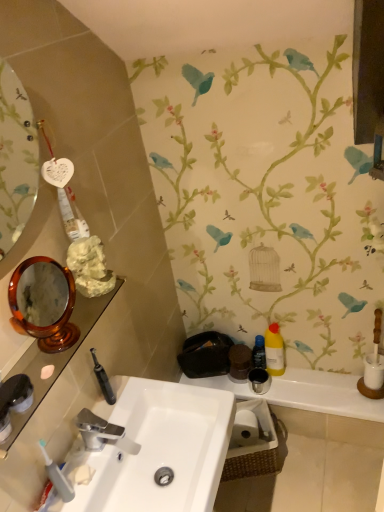
Question: Is point (208, 385) positioned closer to the camera than point (84, 418)?

Choices:
 (A) closer
 (B) farther

Answer: (B)

Question: In the image, is matte black tray at lower center positioned in front of or behind silver metallic faucet at center?

Choices:
 (A) behind
 (B) front

Answer: (A)

Question: Considering the real-world distances, which object is closest to the translucent plastic toothbrush at lower left?

Choices:
 (A) silver metallic faucet at center
 (B) black plastic bottle at right, the 1th mouthwash in the left-to-right sequence
 (C) amber glass mirror at left
 (D) white matte toilet paper at lower center
 (E) white glossy sink at center

Answer: (A)

Question: Which object is the closest to the amber glass mirror at left?

Choices:
 (A) silver metallic faucet at center
 (B) translucent plastic toothbrush at lower left
 (C) black plastic bottle at right, the 1th mouthwash in the left-to-right sequence
 (D) white glossy sink at center
 (E) matte black tray at lower center

Answer: (A)